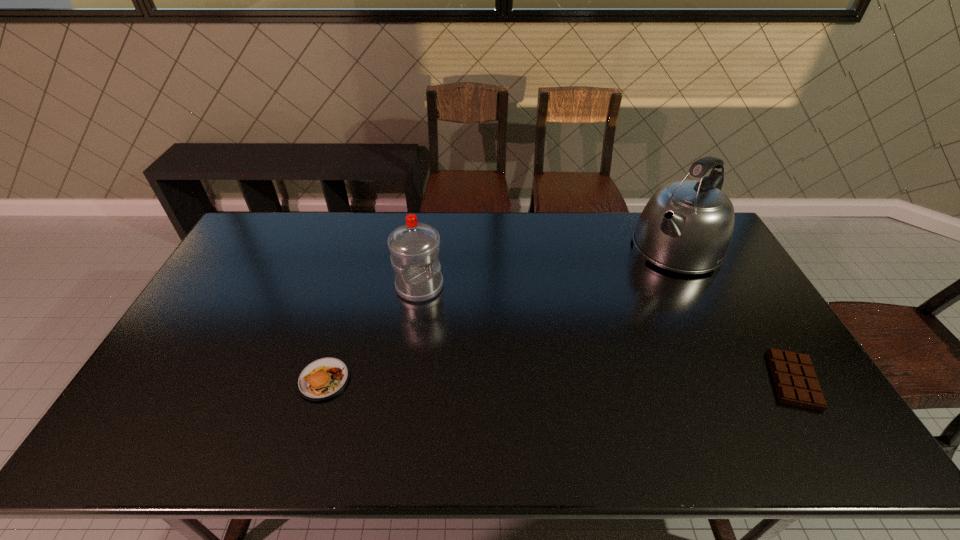
What are the coordinates of `free spot between the water bottle and the leftmost object` in the screenshot? It's located at (372, 333).

The width and height of the screenshot is (960, 540). Find the location of `free space between the kettle and the third tallest object`. free space between the kettle and the third tallest object is located at coordinates (500, 314).

Where is `vacant space in between the patty and the water bottle`? vacant space in between the patty and the water bottle is located at coordinates [372, 333].

The image size is (960, 540). I want to click on vacant space that's between the third object from right to left and the candy bar, so click(607, 333).

You are a GUI agent. You are given a task and a screenshot of the screen. Output one action in this format:
    pyautogui.click(x=<x>, y=<y>)
    Task: Click on the empty space that is in between the water bottle and the patty
    The image size is (960, 540).
    Given the screenshot: What is the action you would take?
    pyautogui.click(x=372, y=333)

Find the location of a particular element. The image size is (960, 540). vacant region between the candy bar and the third shortest object is located at coordinates (607, 333).

Where is `object that is the second closest to the third shortest object`? Image resolution: width=960 pixels, height=540 pixels. object that is the second closest to the third shortest object is located at coordinates (687, 226).

Point out which object is positioned as the third nearest to the third object from right to left. Please provide its 2D coordinates. Your answer should be formatted as a tuple, i.e. [(x, y)], where the tuple contains the x and y coordinates of a point satisfying the conditions above.

[(795, 380)]

Locate an element on the screen. The height and width of the screenshot is (540, 960). blank space that satisfies the following two spatial constraints: 1. on the front side of the leftmost object; 2. on the right side of the shortest object is located at coordinates (324, 380).

Find the location of `free spot that satisfies the following two spatial constraints: 1. on the front side of the candy bar; 2. on the left side of the second object from left to right`. free spot that satisfies the following two spatial constraints: 1. on the front side of the candy bar; 2. on the left side of the second object from left to right is located at coordinates (406, 380).